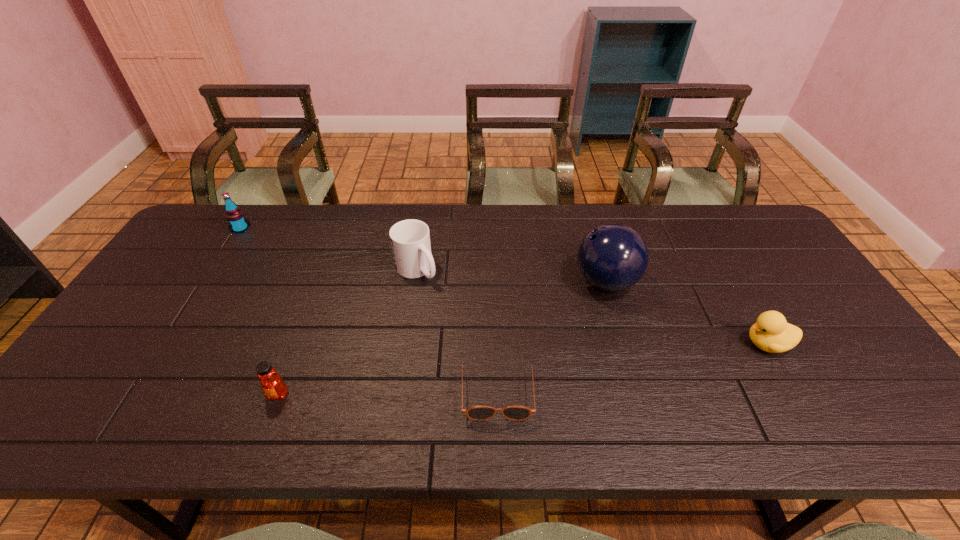
You are a GUI agent. You are given a task and a screenshot of the screen. Output one action in this format:
    pyautogui.click(x=<x>, y=<y>)
    Task: Click on the object that is at the left edge
    This screenshot has height=540, width=960.
    Given the screenshot: What is the action you would take?
    pyautogui.click(x=235, y=217)

Find the location of a particular element. object that is at the right edge is located at coordinates (771, 333).

Where is `object that is at the far left corner`? object that is at the far left corner is located at coordinates (235, 217).

The image size is (960, 540). What are the coordinates of `free space at the far edge` in the screenshot? It's located at (693, 210).

You are a GUI agent. You are given a task and a screenshot of the screen. Output one action in this format:
    pyautogui.click(x=<x>, y=<y>)
    Task: Click on the free space at the near edge
    
    Given the screenshot: What is the action you would take?
    pyautogui.click(x=186, y=426)

Identify the location of vacant space at the near left corner of the desktop. (72, 442).

The height and width of the screenshot is (540, 960). I want to click on free area in between the leftmost object and the rightmost object, so click(504, 286).

What are the coordinates of `unoccupied position between the mug and the third object from right to left` in the screenshot? It's located at (457, 329).

The height and width of the screenshot is (540, 960). Identify the location of blank region between the mug and the bowling ball. (511, 276).

You are a GUI agent. You are given a task and a screenshot of the screen. Output one action in this format:
    pyautogui.click(x=<x>, y=<y>)
    Task: Click on the blank region between the fifth object from left to right and the sunglasses
    
    Given the screenshot: What is the action you would take?
    click(551, 335)